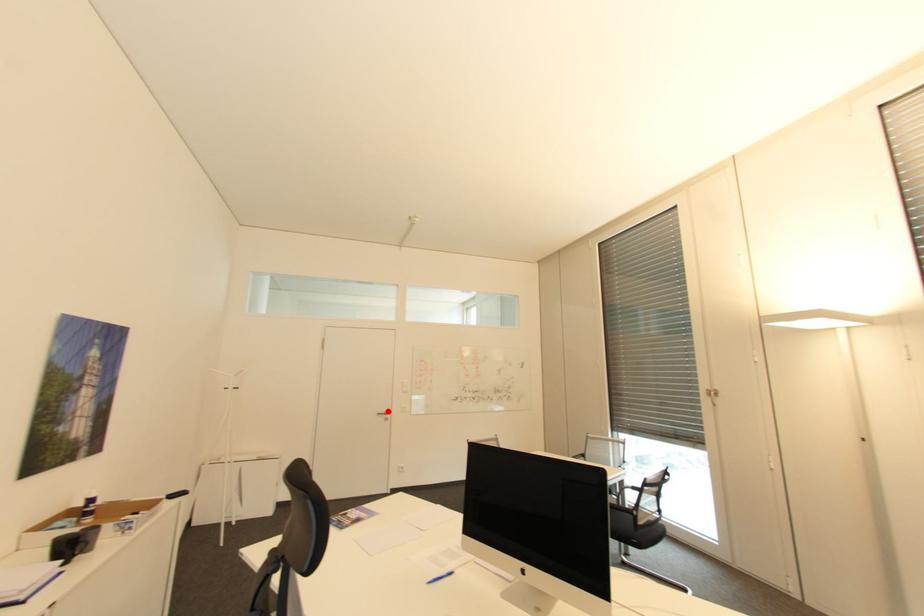
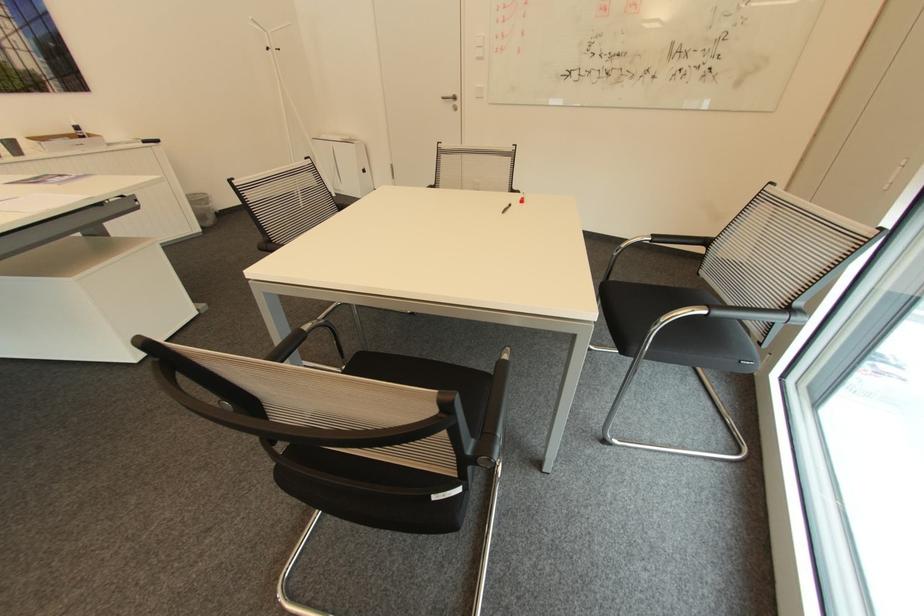
In the second image, find the point that corresponds to the highlighted location in the first image.

(456, 95)